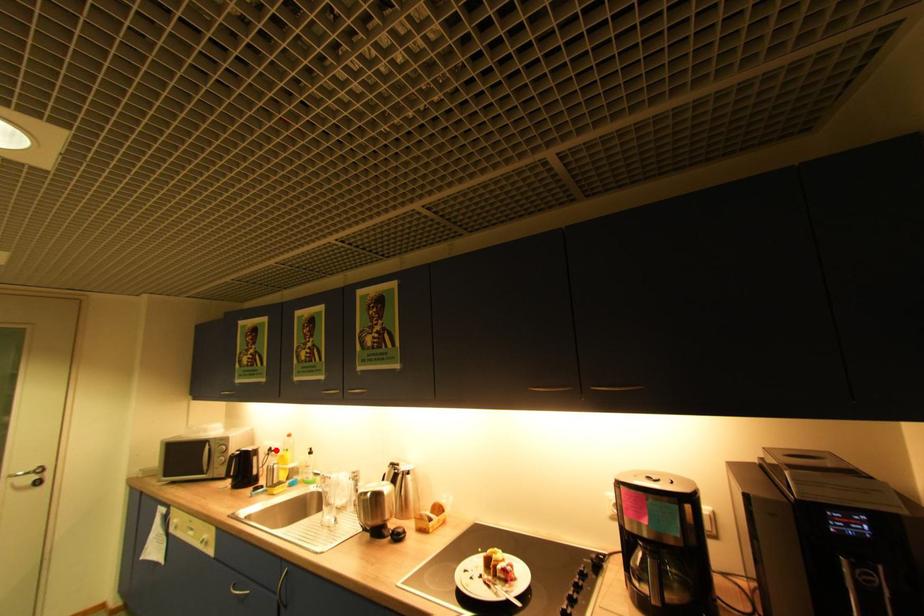
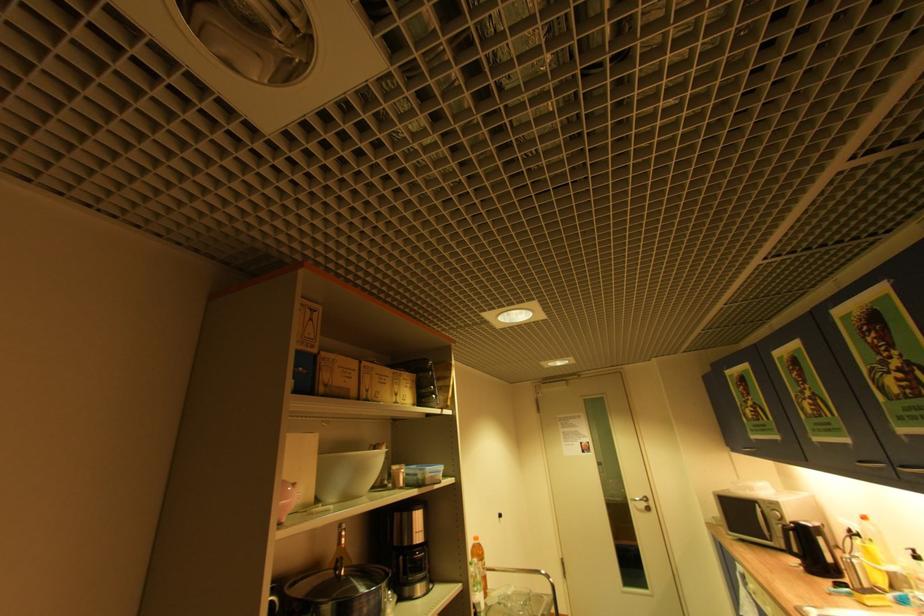
Locate, in the second image, the point that corresponds to the highlighted location in the first image.

(856, 532)